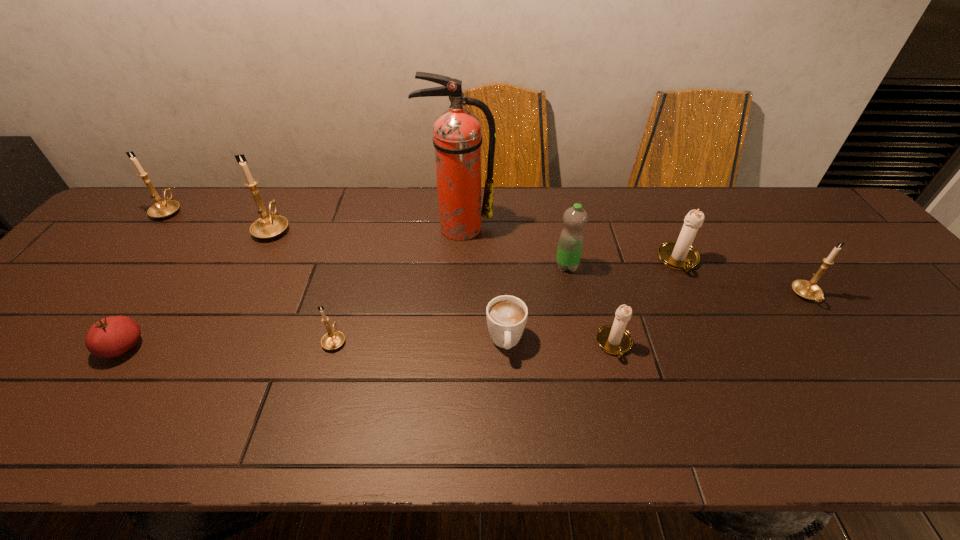
This screenshot has width=960, height=540. I want to click on vacant area between the farther white candle holder and the second candle holder from left to right, so click(x=476, y=245).

Locate an element on the screen. This screenshot has height=540, width=960. unoccupied area between the green water bottle and the nearest gold candle holder is located at coordinates (450, 303).

The width and height of the screenshot is (960, 540). I want to click on free space between the fire extinguisher and the tomato, so click(x=291, y=287).

Identify the location of empty space between the white cappuccino and the leftmost object. (337, 276).

Identify the location of vacant space that's between the rightmost object and the second candle holder from right to left. (743, 278).

I want to click on vacant space in between the fire extinguisher and the second biggest gold candle holder, so click(313, 219).

The height and width of the screenshot is (540, 960). I want to click on vacant point located between the fire extinguisher and the green water bottle, so click(x=513, y=247).

Find the location of a particular element. free point between the leftmost object and the water bottle is located at coordinates (368, 238).

Locate which object ranks sixth in proximity to the third smallest gold candle holder. Please provide its 2D coordinates. Your answer should be formatted as a tuple, i.e. [(x, y)], where the tuple contains the x and y coordinates of a point satisfying the conditions above.

[(575, 218)]

Locate an element on the screen. The height and width of the screenshot is (540, 960). the closest object to the green water bottle is located at coordinates (457, 139).